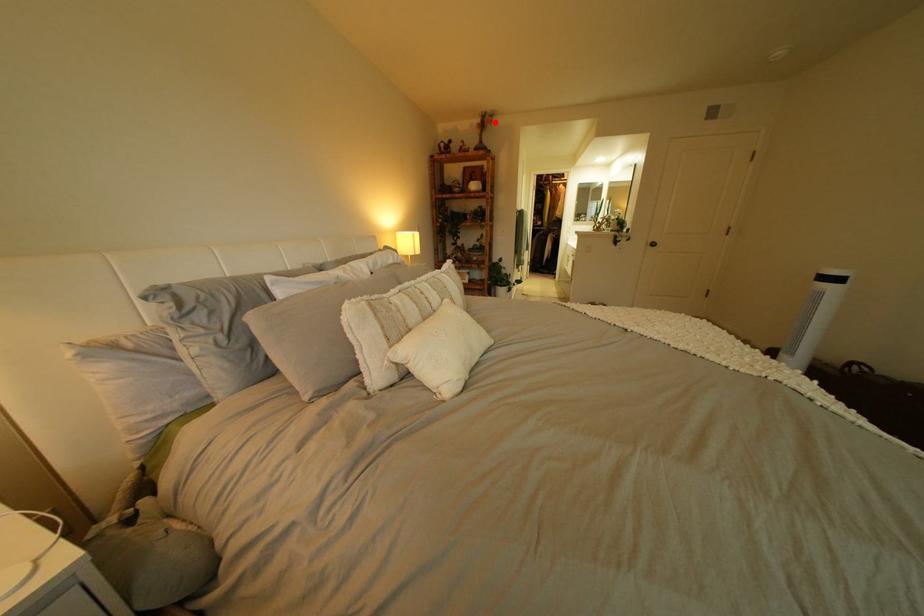
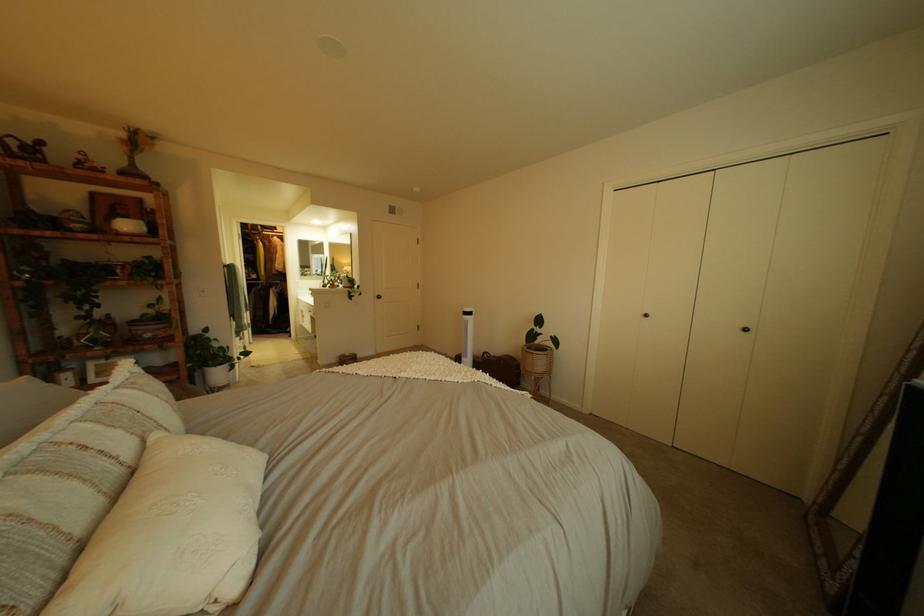
Where in the second image is the point corresponding to the highlighted location from the first image?

(139, 137)